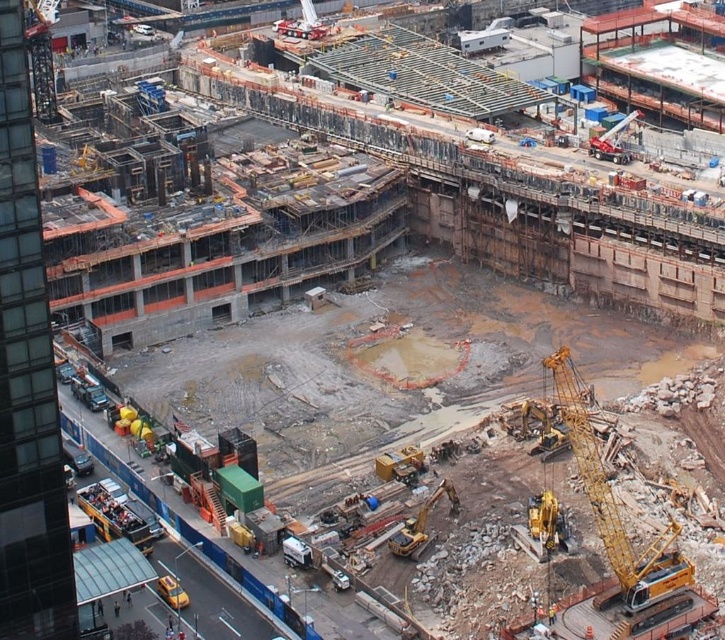
Consider the image. You are a delivery truck driver who needs to transport materials from the crane to the excavator. Given the distance between the yellow metallic crane at lower right and the yellow metallic excavator at center, can you estimate how long it will take to drive the materials between them?

The distance between the yellow metallic crane at lower right and the yellow metallic excavator at center is 62.73 feet. Assuming an average driving speed of 5 mph, it would take approximately 0.07 minutes or about 4 seconds to cover this distance.

You are a construction worker planning to move a heavy load from the excavator to the yellow metallic crane at lower right. Given the coordinates provided in the Objects Description, can you determine if the crane is positioned within the fenced area on the left side of the site?

The yellow metallic crane at lower right is located at point (x=624, y=545). Since the fenced area is on the left side of the site, the crane is positioned outside the fenced area and cannot be used for moving the load within that section.